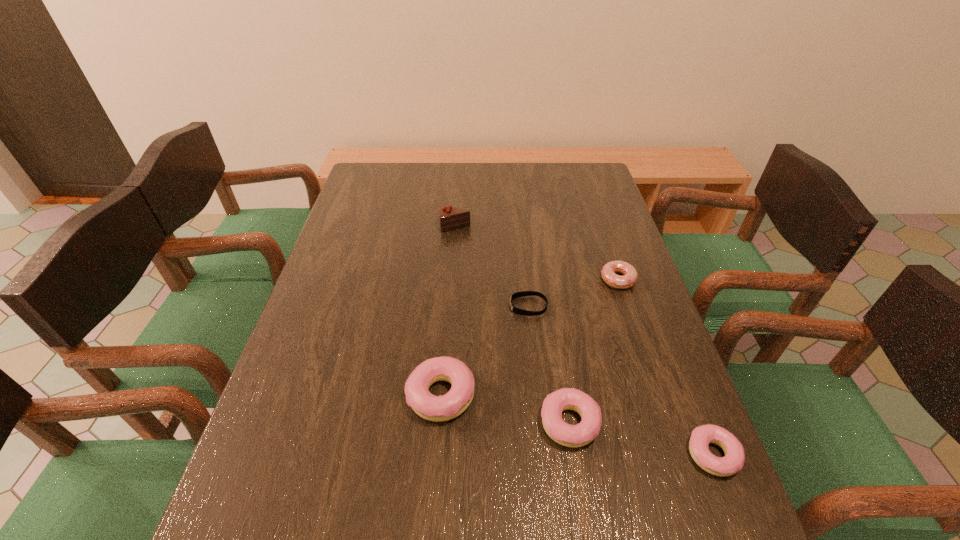
Image resolution: width=960 pixels, height=540 pixels. What are the coordinates of `the leftmost doughnut` in the screenshot? It's located at (445, 407).

In order to click on the tallest doughnut in this screenshot , I will do `click(445, 407)`.

This screenshot has height=540, width=960. I want to click on the fourth shortest object, so click(583, 433).

Find the location of a particular element. the second tallest doughnut is located at coordinates (583, 433).

Locate an element on the screen. Image resolution: width=960 pixels, height=540 pixels. the farthest doughnut is located at coordinates (608, 271).

You are a GUI agent. You are given a task and a screenshot of the screen. Output one action in this format:
    pyautogui.click(x=<x>, y=<y>)
    Task: Click on the tallest object
    This screenshot has height=540, width=960.
    Given the screenshot: What is the action you would take?
    pyautogui.click(x=450, y=218)

The height and width of the screenshot is (540, 960). Find the location of `the farthest object`. the farthest object is located at coordinates (450, 218).

Where is `wristband`? Image resolution: width=960 pixels, height=540 pixels. wristband is located at coordinates (518, 311).

You are a GUI agent. You are given a task and a screenshot of the screen. Output one action in this format:
    pyautogui.click(x=<x>, y=<y>)
    Task: Click on the shortest object
    The image size is (960, 540).
    Given the screenshot: What is the action you would take?
    pyautogui.click(x=518, y=311)

The width and height of the screenshot is (960, 540). In order to click on free space located 0.050m on the right of the second tallest object in this screenshot , I will do `click(498, 395)`.